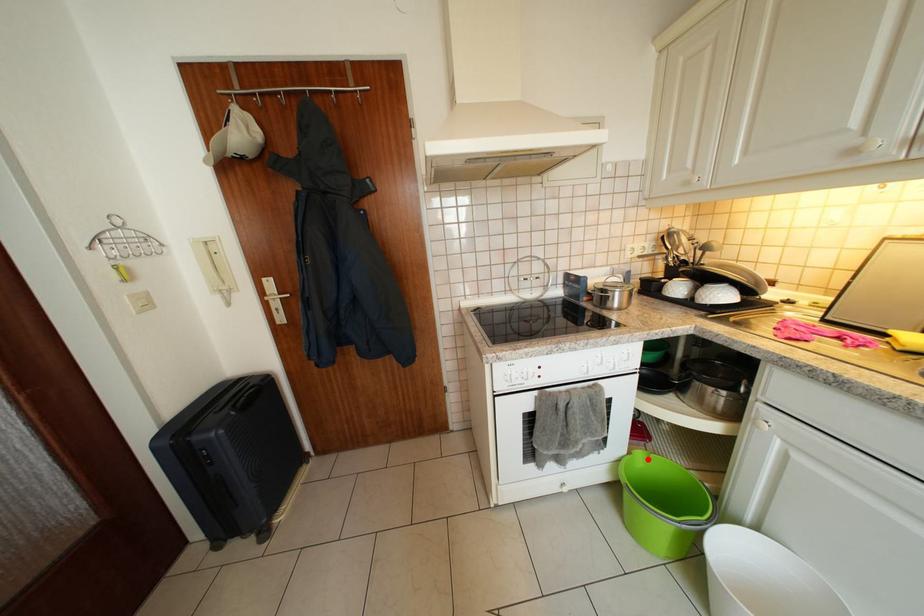
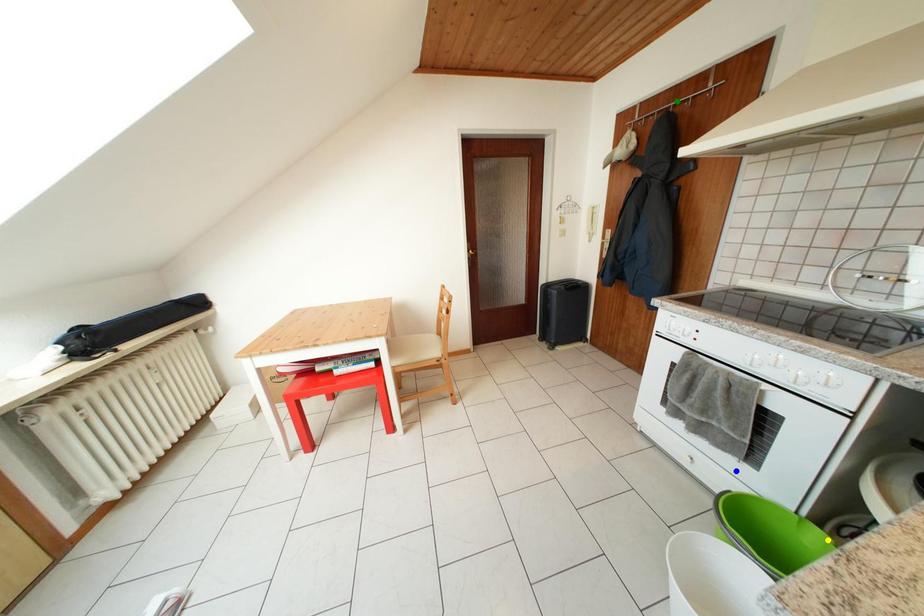
Question: I am providing you with two images of the same scene from different viewpoints. A red point is marked on the first image. You are given multiple points on the second image. Which spot in image 2 lines up with the point in image 1?

Choices:
 (A) green point
 (B) blue point
 (C) yellow point

Answer: (C)